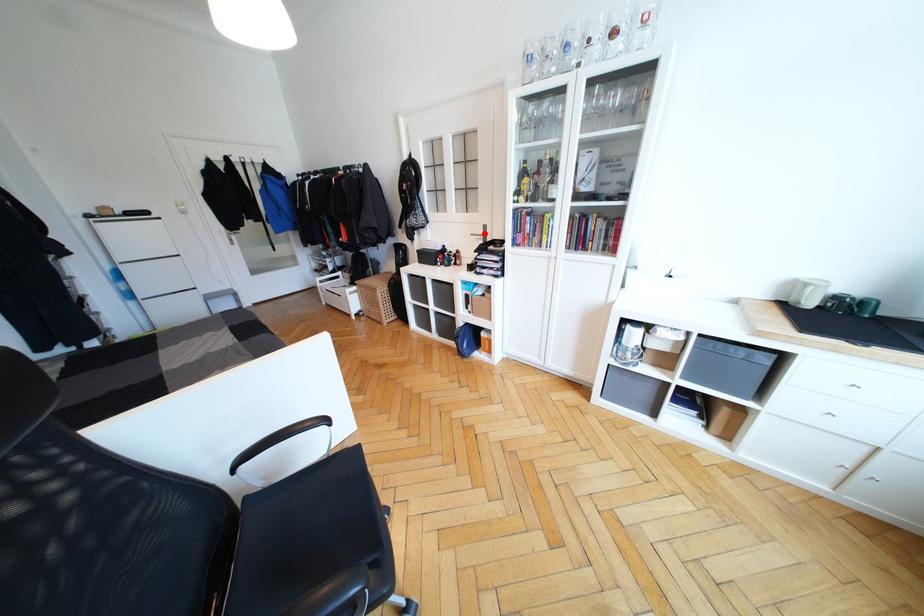
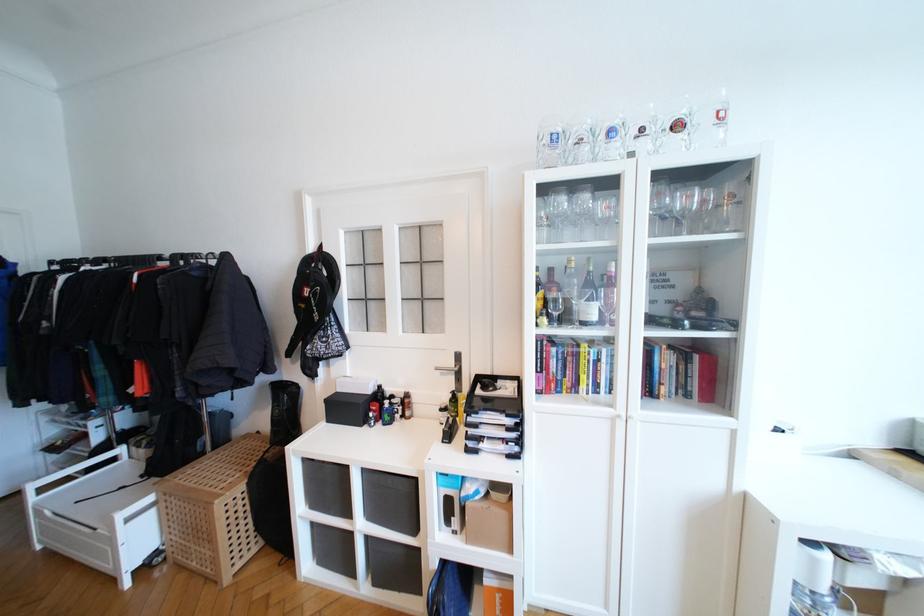
Question: A red point is marked in image1. In image2, is the corresponding 3D point closer to the camera or farther? Reply with the corresponding letter.

Choices:
 (A) The corresponding 3D point is closer.
 (B) The corresponding 3D point is farther.

Answer: (B)